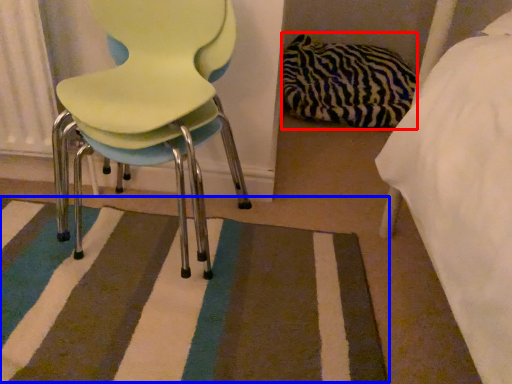
Question: Which point is closer to the camera, material (highlighted by a red box) or mat (highlighted by a blue box)?

Choices:
 (A) material
 (B) mat

Answer: (B)